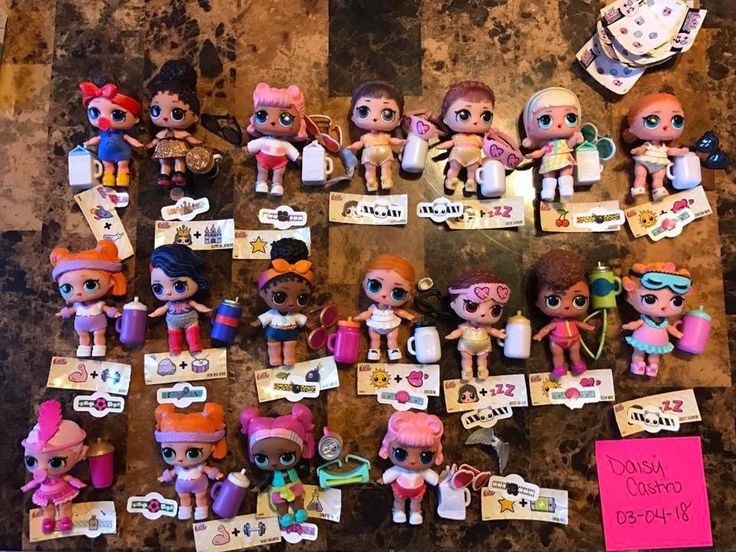
Find the location of `dolls with headwear`. dolls with headwear is located at coordinates (52, 450), (185, 444), (271, 429), (488, 293), (670, 285), (304, 279), (82, 277), (105, 113).